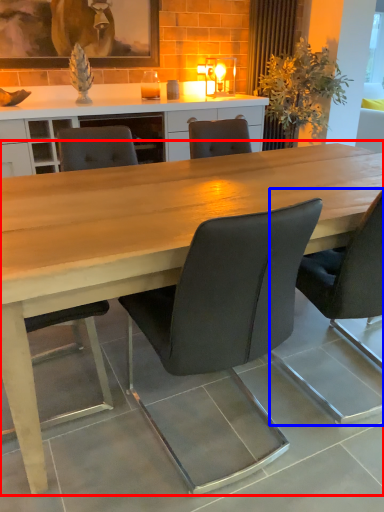
Question: Which object appears closest to the camera in this image, table (highlighted by a red box) or chair (highlighted by a blue box)?

Choices:
 (A) table
 (B) chair

Answer: (A)